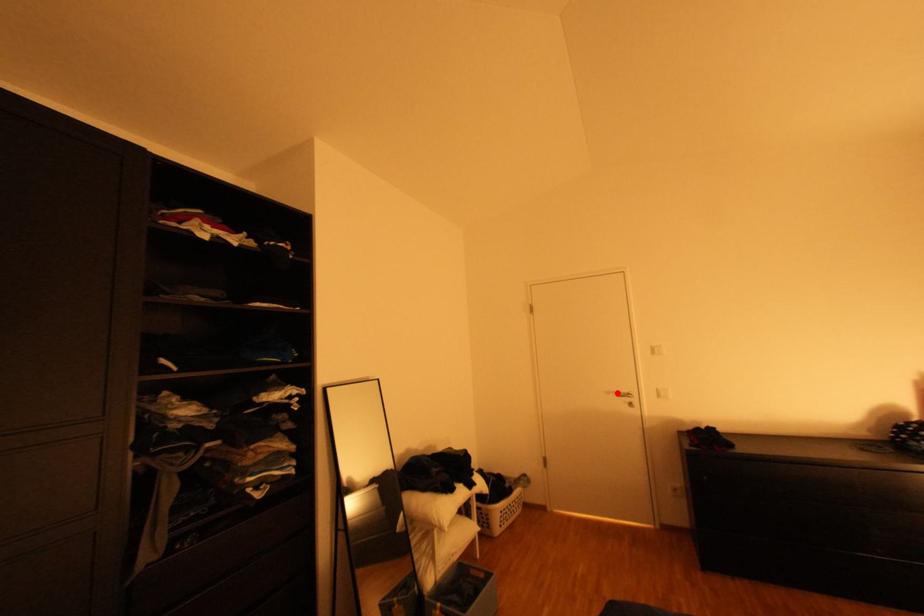
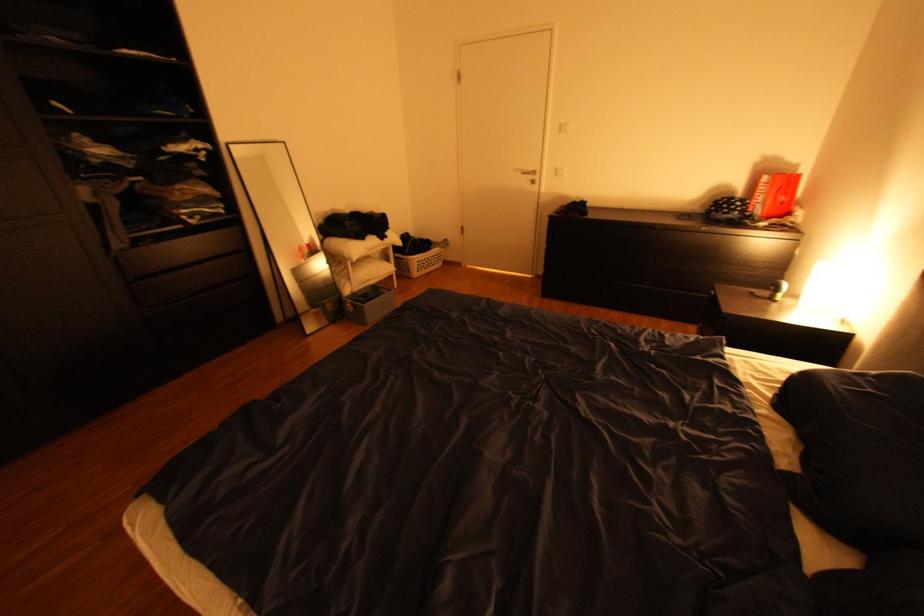
The point at the highlighted location is marked in the first image. Where is the corresponding point in the second image?

(526, 171)